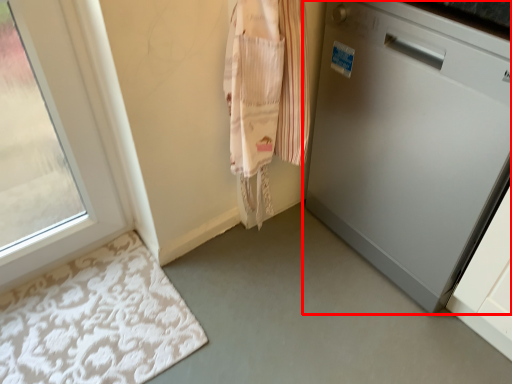
Question: In this image, where is home appliance (annotated by the red box) located relative to bath mat?

Choices:
 (A) right
 (B) left

Answer: (A)